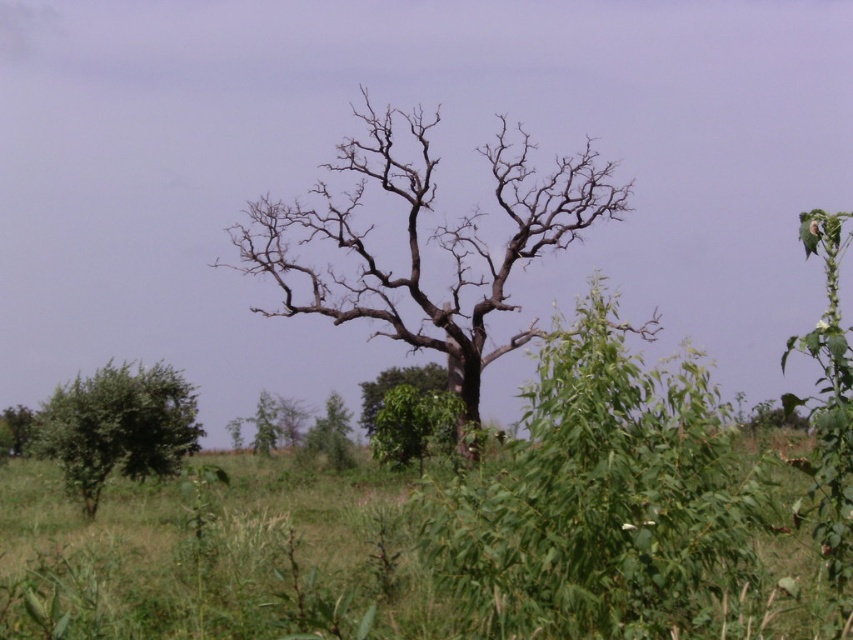
Question: Which point is farther to the camera?

Choices:
 (A) (x=380, y=385)
 (B) (x=457, y=264)
 (C) (x=91, y=506)

Answer: (A)

Question: Does brown/dry wood tree at center have a smaller size compared to green leafy tree at center?

Choices:
 (A) no
 (B) yes

Answer: (A)

Question: Which point is farther from the camera taking this photo?

Choices:
 (A) (131, 403)
 (B) (376, 410)

Answer: (B)

Question: Among these points, which one is nearest to the camera?

Choices:
 (A) (397, 378)
 (B) (84, 378)

Answer: (B)

Question: Is brown/dry wood tree at center to the right of green leafy tree at center from the viewer's perspective?

Choices:
 (A) no
 (B) yes

Answer: (B)

Question: Does brown/dry wood tree at center have a smaller size compared to green leafy shrub at lower left?

Choices:
 (A) yes
 (B) no

Answer: (B)